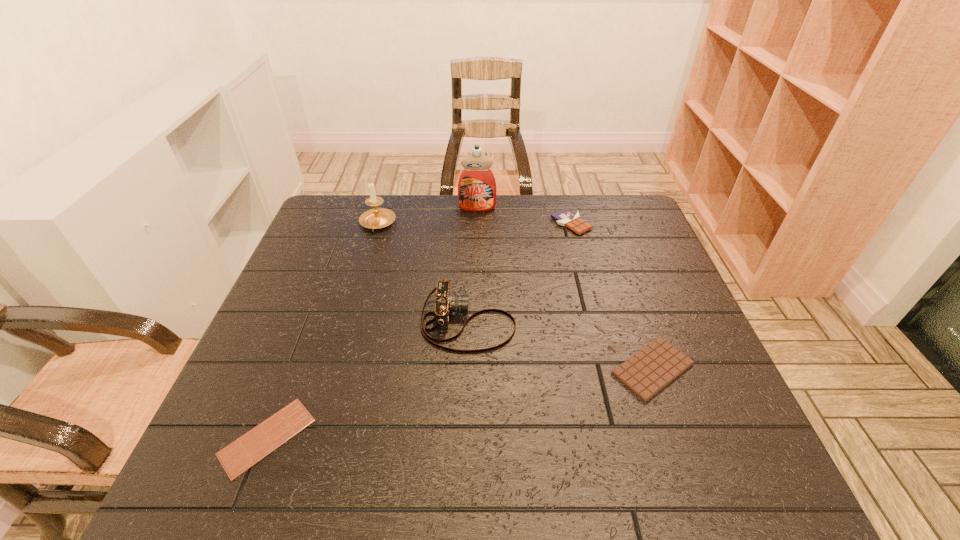
Choose which object is the second nearest neighbor to the fourth shortest object. Please provide its 2D coordinates. Your answer should be formatted as a tuple, i.e. [(x, y)], where the tuple contains the x and y coordinates of a point satisfying the conditions above.

[(243, 453)]

Choose which object is the fifth nearest neighbor to the shortest object. Please provide its 2D coordinates. Your answer should be formatted as a tuple, i.e. [(x, y)], where the tuple contains the x and y coordinates of a point satisfying the conditions above.

[(564, 217)]

The height and width of the screenshot is (540, 960). What are the coordinates of `chocolate bar that is the closest to the shortest object` in the screenshot? It's located at (647, 372).

Locate an element on the screen. This screenshot has width=960, height=540. chocolate bar that is the closest to the farthest chocolate bar is located at coordinates (647, 372).

You are a GUI agent. You are given a task and a screenshot of the screen. Output one action in this format:
    pyautogui.click(x=<x>, y=<y>)
    Task: Click on the vacant space that satisfies the following two spatial constraints: 1. on the front surface of the tallest object; 2. on the right side of the second shortest chocolate bar
    This screenshot has width=960, height=540.
    Given the screenshot: What is the action you would take?
    pyautogui.click(x=476, y=369)

The image size is (960, 540). In order to click on vacant area in the image that satisfies the following two spatial constraints: 1. on the front surface of the detergent; 2. on the left side of the farthest chocolate bar in this screenshot , I will do `click(477, 224)`.

Locate an element on the screen. free space that satisfies the following two spatial constraints: 1. on the front surface of the tallest object; 2. on the right side of the third shortest object is located at coordinates (477, 224).

You are a GUI agent. You are given a task and a screenshot of the screen. Output one action in this format:
    pyautogui.click(x=<x>, y=<y>)
    Task: Click on the vacant space that satisfies the following two spatial constraints: 1. on the front surface of the tallest object; 2. on the front-facing side of the fourth shortest object
    
    Given the screenshot: What is the action you would take?
    pyautogui.click(x=476, y=322)

The image size is (960, 540). What are the coordinates of `free point that satisfies the following two spatial constraints: 1. on the front-facing side of the third tallest object; 2. on the right side of the second shortest chocolate bar` in the screenshot? It's located at (467, 369).

The image size is (960, 540). In order to click on vacant space that satisfies the following two spatial constraints: 1. on the front side of the farthest chocolate bar; 2. on the right side of the second shortest object in this screenshot , I will do `click(610, 369)`.